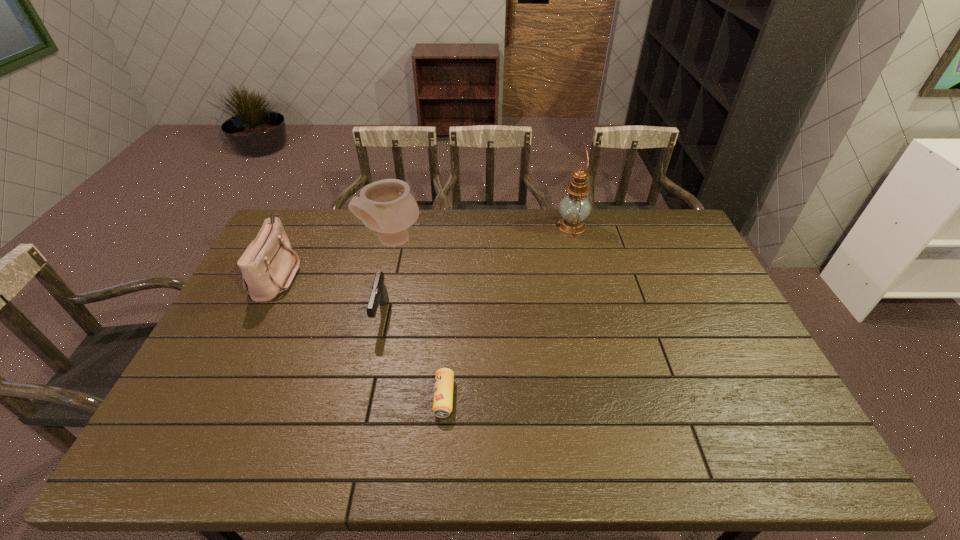
This screenshot has width=960, height=540. I want to click on vacant point located between the rightmost object and the nearest object, so click(x=508, y=312).

At what (x,y) coordinates should I click in order to perform the action: click on vacant area between the fourth shortest object and the tallest object. Please return your answer as a coordinate pair (x, y). Looking at the image, I should click on (482, 233).

At what (x,y) coordinates should I click in order to perform the action: click on free area in between the pistol and the shortest object. Please return your answer as a coordinate pair (x, y). The image size is (960, 540). Looking at the image, I should click on (413, 356).

Find the location of `vacant space in between the second shortest object and the second tallest object`. vacant space in between the second shortest object and the second tallest object is located at coordinates (387, 278).

At what (x,y) coordinates should I click in order to perform the action: click on free space between the third tallest object and the second tallest object. Please return your answer as a coordinate pair (x, y). The image size is (960, 540). Looking at the image, I should click on (335, 258).

You are a GUI agent. You are given a task and a screenshot of the screen. Output one action in this format:
    pyautogui.click(x=<x>, y=<y>)
    Task: Click on the vacant space in between the leftmost object and the second shortest object
    
    Given the screenshot: What is the action you would take?
    pyautogui.click(x=329, y=295)

Find the location of a particular element. free point between the fourth tallest object and the oil lamp is located at coordinates (476, 271).

You are a GUI agent. You are given a task and a screenshot of the screen. Output one action in this format:
    pyautogui.click(x=<x>, y=<y>)
    Task: Click on the vacant region between the pottery and the leftmost object
    This screenshot has width=960, height=540.
    Given the screenshot: What is the action you would take?
    pos(335,258)

Find the location of `free spot between the third tallest object and the fourth tallest object`. free spot between the third tallest object and the fourth tallest object is located at coordinates (329, 295).

You are a GUI agent. You are given a task and a screenshot of the screen. Output one action in this format:
    pyautogui.click(x=<x>, y=<y>)
    Task: Click on the empty space that is in between the oil lamp and the shortest object
    
    Given the screenshot: What is the action you would take?
    [508, 312]